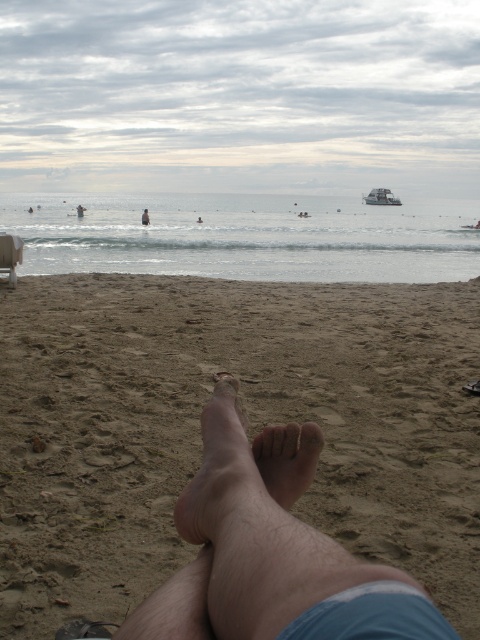
You are lying on the beach and want to reach the clear blue water at upper center without getting your brown rough toe at center wet. Is it possible?

The clear blue water at upper center is much taller than the brown rough toe at center, so the water is higher up. Therefore, if you move towards the water from your current position, your toe might get wet as you approach the water. However, if you stay where you are, your toe won t be submerged since the water is higher up. It depends on how far you move.

From the picture: You are trying to place a small beach umbrella between the pale skin foot at lower center and the white plastic chair at lower left. Based on their heights, can the umbrella be placed without blocking the view of both objects?

The pale skin foot at lower center is not as tall as the white plastic chair at lower left, so the umbrella can be placed between them without blocking the view of both objects since the taller white plastic chair at lower left would likely obscure the shorter foot.

You are lying on the beach and want to reach the clear blue water at upper center without stepping on the brown rough toe at center. Which direction should you move your legs?

You should move your legs downward to avoid the brown rough toe at center and reach the clear blue water at upper center, since the clear blue water at upper center is above the brown rough toe at center.